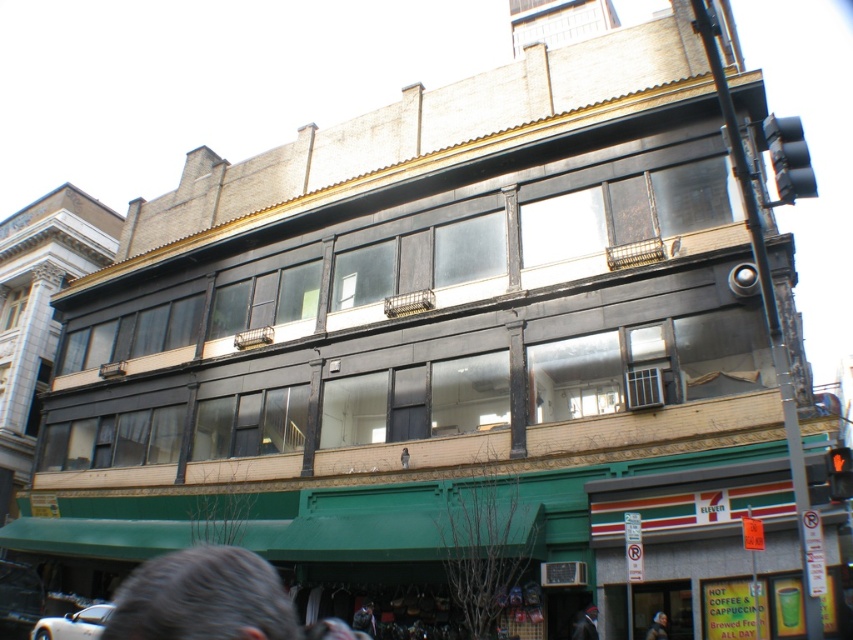
Is point (585, 630) more distant than point (656, 628)?

No, it is in front of (656, 628).

What are the coordinates of `smooth black hair at lower center` in the screenshot? It's located at (585, 625).

Where is `smooth black hair at lower center`? smooth black hair at lower center is located at coordinates (585, 625).

In order to click on smooth black hair at lower center in this screenshot , I will do 585,625.

Can you confirm if gray matte hair at lower left is positioned above smooth black hair at lower center?

Yes.

Identify the location of gray matte hair at lower left. (202, 598).

Which is in front, point (148, 592) or point (589, 620)?

Point (148, 592)

Locate an element on the screen. Image resolution: width=853 pixels, height=640 pixels. gray matte hair at lower left is located at coordinates (202, 598).

Does gray matte hair at lower left have a larger size compared to dark brown leather jacket at lower right?

Indeed, gray matte hair at lower left has a larger size compared to dark brown leather jacket at lower right.

Which is behind, point (200, 637) or point (664, 618)?

The point (664, 618) is more distant.

Is point (236, 547) farther from camera compared to point (659, 634)?

Yes, it is.

The height and width of the screenshot is (640, 853). Find the location of `gray matte hair at lower left`. gray matte hair at lower left is located at coordinates (202, 598).